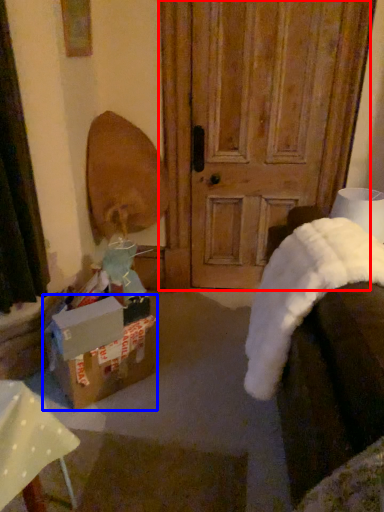
Question: Which object is closer to the camera taking this photo, door (highlighted by a red box) or box (highlighted by a blue box)?

Choices:
 (A) door
 (B) box

Answer: (B)